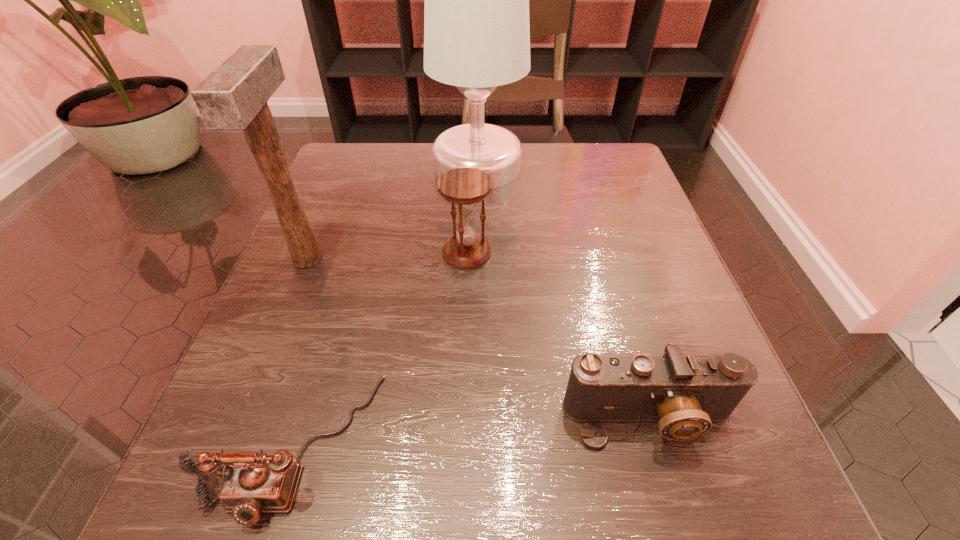
Locate an element on the screen. The height and width of the screenshot is (540, 960). the tallest object is located at coordinates (476, 16).

Identify the location of lampshade. coord(476,16).

Find the location of a particular element. mallet is located at coordinates (234, 96).

Find the location of `the third shortest object`. the third shortest object is located at coordinates (464, 187).

You are a GUI agent. You are given a task and a screenshot of the screen. Output one action in this format:
    pyautogui.click(x=<x>, y=<y>)
    Task: Click on the second shortest object
    
    Given the screenshot: What is the action you would take?
    pyautogui.click(x=684, y=393)

Locate an element on the screen. This screenshot has height=540, width=960. the rightmost object is located at coordinates (684, 393).

This screenshot has width=960, height=540. What are the coordinates of `telephone` in the screenshot? It's located at (254, 483).

You are a GUI agent. You are given a task and a screenshot of the screen. Output one action in this format:
    pyautogui.click(x=<x>, y=<y>)
    Task: Click on the free spot located on the base of the farthest object
    This screenshot has height=540, width=960.
    Given the screenshot: What is the action you would take?
    pyautogui.click(x=615, y=166)

The height and width of the screenshot is (540, 960). What are the coordinates of `vacant space located on the back of the mallet` in the screenshot? It's located at (349, 156).

Find the location of a particular element. The height and width of the screenshot is (540, 960). vacant space located on the right of the hourglass is located at coordinates (640, 252).